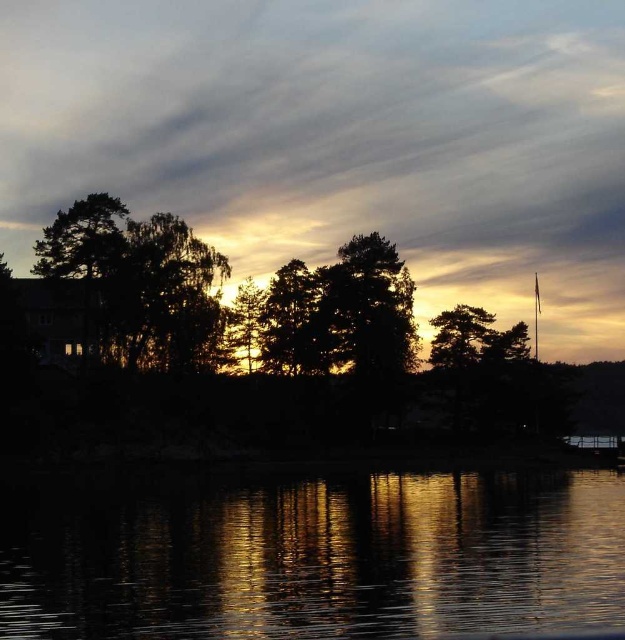
From the picture: You are an artist trying to capture the scene. You need to paint the golden translucent clouds at upper center and the glistening reflective water at center. Based on the scene, which object should you paint first to ensure proper layering?

The golden translucent clouds at upper center should be painted first since they are located above the glistening reflective water at center, allowing the water to be layered beneath them appropriately.

You are an artist trying to paint the scene. You need to decide where to place the golden translucent clouds at upper center and the silhouette tree at center. According to the scene, which object should be placed wider in your painting?

→ The golden translucent clouds at upper center might be wider than the silhouette tree at center, so you should paint the golden translucent clouds at upper center wider than the silhouette tree at center.

You are an artist trying to paint the scene. You need to decide whether to use a wider brush for the golden translucent clouds at upper center or the green matte tree at center. Which object requires a wider brush based on their sizes in the image?

The golden translucent clouds at upper center might be wider than the green matte tree at center, so you should use a wider brush for the golden translucent clouds at upper center.